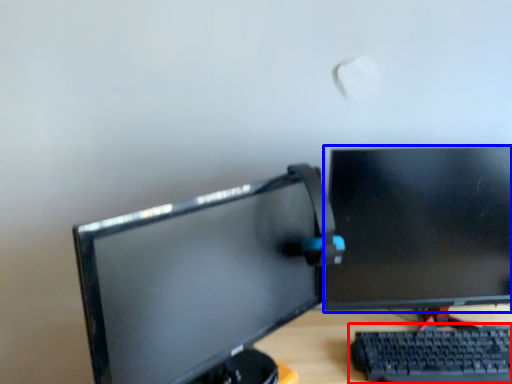
Question: Which object appears farthest to the camera in this image, computer keyboard (highlighted by a red box) or computer monitor (highlighted by a blue box)?

Choices:
 (A) computer keyboard
 (B) computer monitor

Answer: (B)